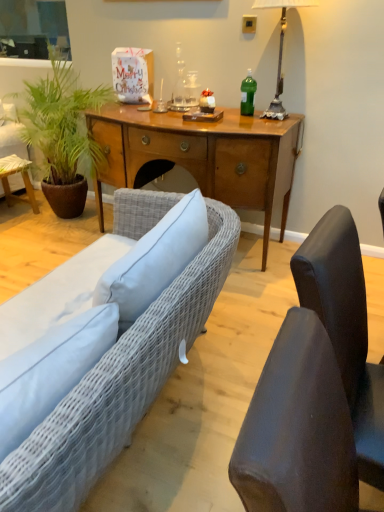
Question: Is woven fabric couch at lower left thinner than green leafy plant at left?

Choices:
 (A) no
 (B) yes

Answer: (A)

Question: Considering the relative sizes of woven fabric couch at lower left and green leafy plant at left in the image provided, is woven fabric couch at lower left shorter than green leafy plant at left?

Choices:
 (A) yes
 (B) no

Answer: (A)

Question: Is woven fabric couch at lower left at the right side of green leafy plant at left?

Choices:
 (A) no
 (B) yes

Answer: (B)

Question: Does woven fabric couch at lower left have a larger size compared to green leafy plant at left?

Choices:
 (A) yes
 (B) no

Answer: (B)

Question: Is woven fabric couch at lower left looking in the opposite direction of green leafy plant at left?

Choices:
 (A) yes
 (B) no

Answer: (B)

Question: From the image's perspective, is woven fabric couch at lower left located above green leafy plant at left?

Choices:
 (A) yes
 (B) no

Answer: (B)

Question: Does metallic silver lamp at upper right appear on the right side of green plastic bottle at center?

Choices:
 (A) no
 (B) yes

Answer: (B)

Question: Is metallic silver lamp at upper right not within green plastic bottle at center?

Choices:
 (A) yes
 (B) no

Answer: (A)

Question: Could you tell me if metallic silver lamp at upper right is facing green plastic bottle at center?

Choices:
 (A) no
 (B) yes

Answer: (A)

Question: Is metallic silver lamp at upper right bigger than green plastic bottle at center?

Choices:
 (A) no
 (B) yes

Answer: (B)

Question: Does metallic silver lamp at upper right have a smaller size compared to green plastic bottle at center?

Choices:
 (A) no
 (B) yes

Answer: (A)

Question: Is metallic silver lamp at upper right not near green plastic bottle at center?

Choices:
 (A) no
 (B) yes

Answer: (A)

Question: From the image's perspective, is green leafy plant at left above metallic silver lamp at upper right?

Choices:
 (A) yes
 (B) no

Answer: (B)